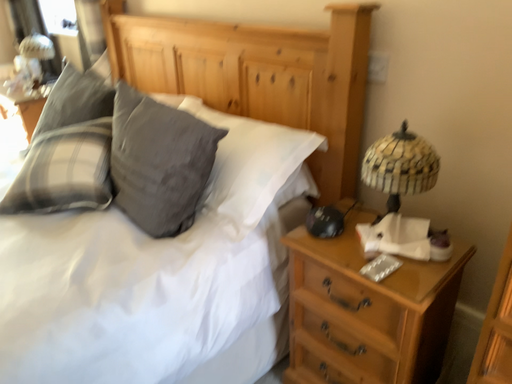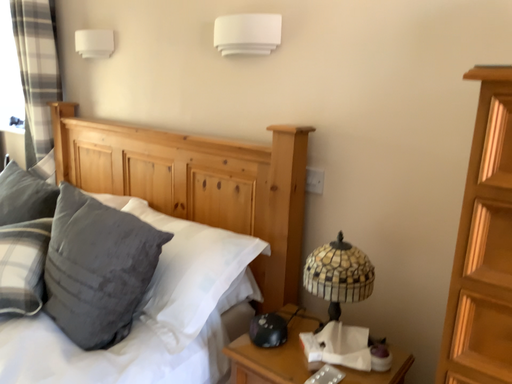
Question: How did the camera likely rotate when shooting the video?

Choices:
 (A) rotated downward
 (B) rotated upward

Answer: (B)